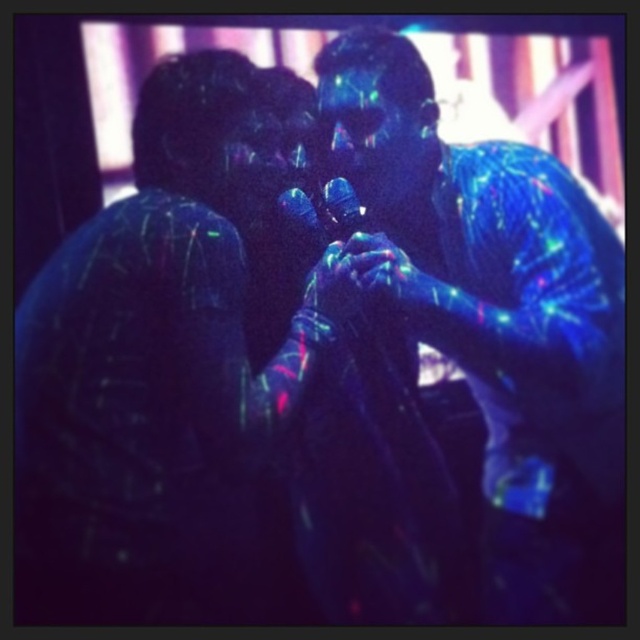
Question: Estimate the real-world distances between objects in this image. Which object is closer to the neon plastic hand at center?

Choices:
 (A) translucent plastic microphone at center
 (B) neon blue fabric at center

Answer: (B)

Question: Which is nearer to the translucent plastic microphone at center?

Choices:
 (A) neon blue skin at center
 (B) neon blue fabric at center
 (C) neon plastic hand at center

Answer: (B)

Question: Is neon blue fabric at center smaller than neon plastic hand at center?

Choices:
 (A) yes
 (B) no

Answer: (B)

Question: Where is neon blue fabric at center located in relation to metallic blue microphone at center in the image?

Choices:
 (A) above
 (B) below

Answer: (B)

Question: Can you confirm if neon blue fabric at center is positioned to the right of neon plastic hand at center?

Choices:
 (A) yes
 (B) no

Answer: (B)

Question: Estimate the real-world distances between objects in this image. Which object is closer to the neon plastic hand at center?

Choices:
 (A) neon blue fabric at center
 (B) neon blue skin at center

Answer: (A)